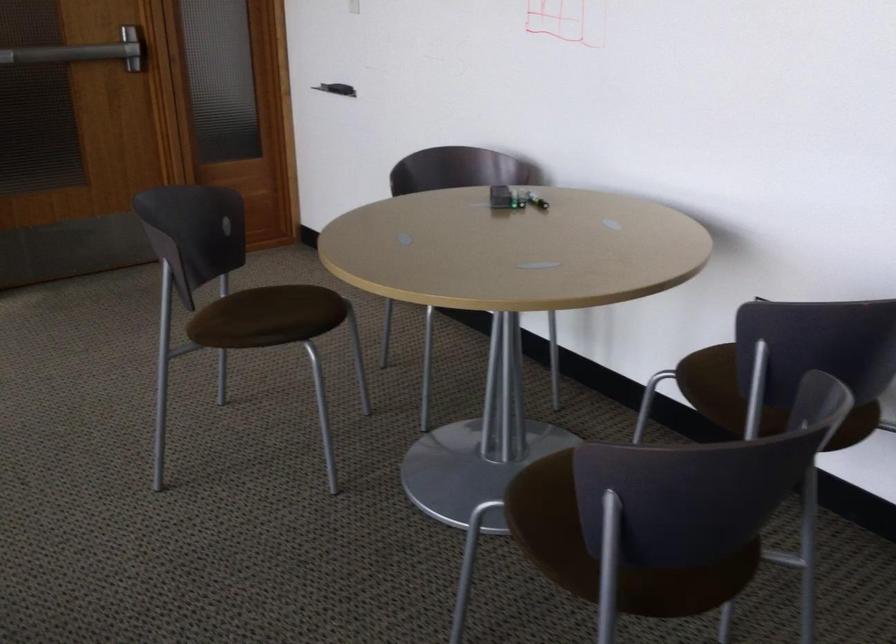
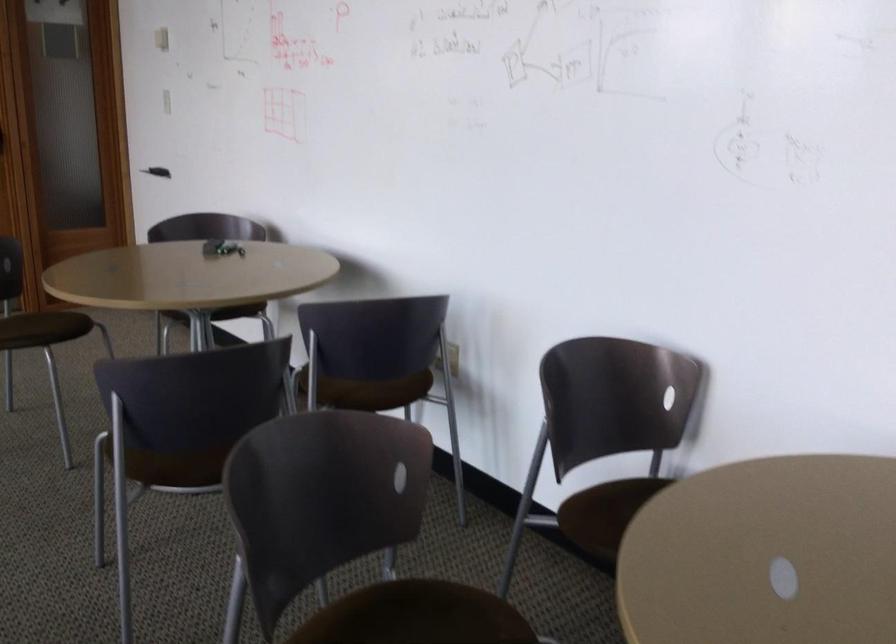
Question: I am providing you with two images of the same scene from different viewpoints. Please identify which objects are invisible in image2.

Choices:
 (A) black whiteboard eraser
 (B) orange highlighter
 (C) set of keys
 (D) brown chair sitting surface

Answer: (A)